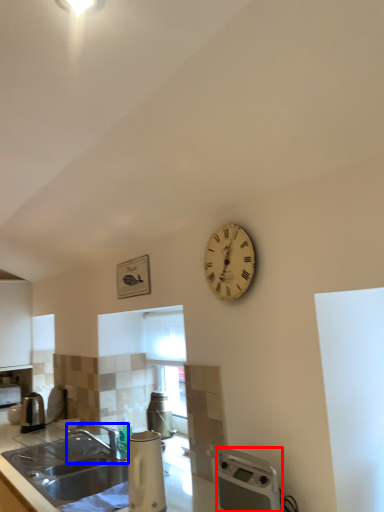
Question: Among these objects, which one is farthest to the camera, water heater (highlighted by a red box) or tap (highlighted by a blue box)?

Choices:
 (A) water heater
 (B) tap

Answer: (B)